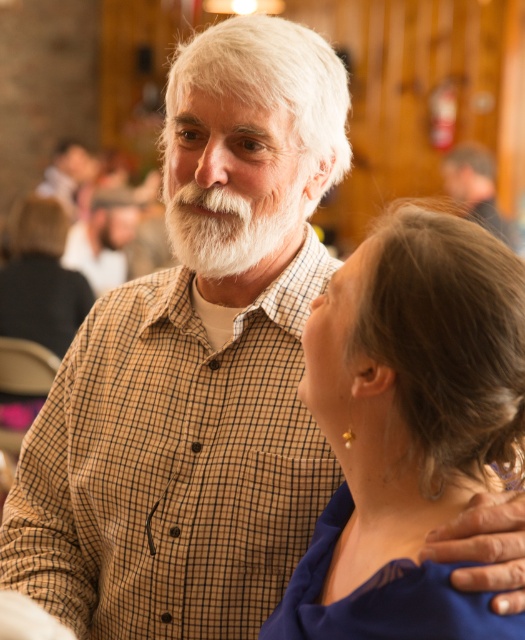
Can you confirm if blue satin blouse at center is smaller than white fluffy beard at center?

Actually, blue satin blouse at center might be larger than white fluffy beard at center.

What do you see at coordinates (407, 426) in the screenshot? I see `blue satin blouse at center` at bounding box center [407, 426].

This screenshot has height=640, width=525. Identify the location of blue satin blouse at center. (407, 426).

Which of these two, brown plaid shirt at upper right or matte brown shirt at upper left, stands taller?

brown plaid shirt at upper right

Is point (446, 168) closer to viewer compared to point (61, 196)?

Yes, point (446, 168) is in front of point (61, 196).

Where is `brown plaid shirt at upper right`? This screenshot has width=525, height=640. brown plaid shirt at upper right is located at coordinates (476, 188).

Is blue satin blouse at center below brown plaid shirt at upper right?

Yes, blue satin blouse at center is below brown plaid shirt at upper right.

At what (x,y) coordinates should I click in order to perform the action: click on blue satin blouse at center. Please return your answer as a coordinate pair (x, y). Looking at the image, I should click on point(407,426).

This screenshot has width=525, height=640. I want to click on blue satin blouse at center, so click(x=407, y=426).

I want to click on blue satin blouse at center, so click(407, 426).